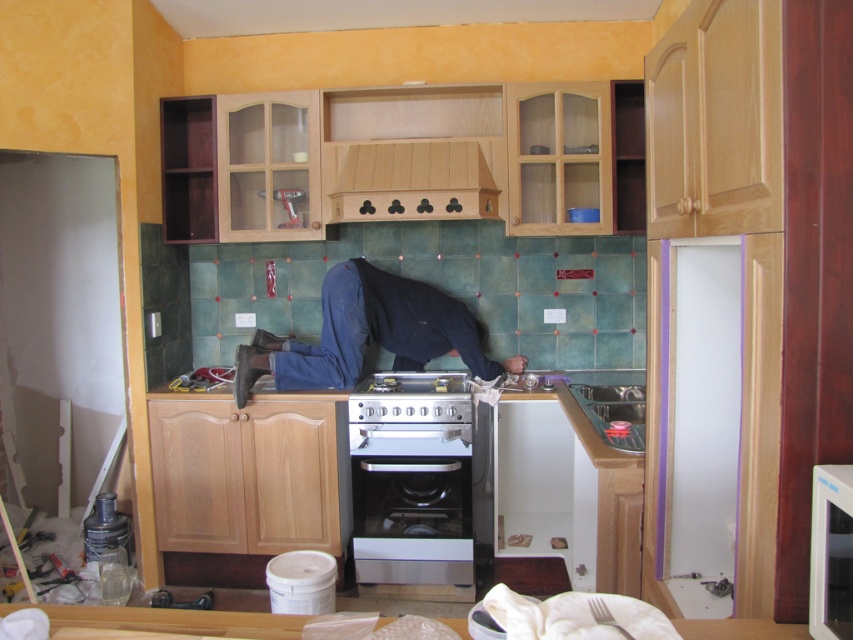
Who is more forward, (x=390, y=172) or (x=413, y=378)?

Point (x=390, y=172)

Is wooden exhaust hood at upper center shorter than silver metallic gas stove at center?

Incorrect, wooden exhaust hood at upper center's height does not fall short of silver metallic gas stove at center's.

Who is more distant from viewer, (340, 168) or (386, 404)?

Point (340, 168)

Find the location of a particular element. The height and width of the screenshot is (640, 853). wooden exhaust hood at upper center is located at coordinates (413, 182).

Who is shorter, blue denim jeans at center or matte stainless steel sink at lower right?

matte stainless steel sink at lower right is shorter.

Does point (352, 276) come closer to viewer compared to point (578, 392)?

That is False.

Does point (444, 340) come behind point (618, 406)?

Yes.

Locate an element on the screen. blue denim jeans at center is located at coordinates (369, 333).

Identify the location of white glossy microwave at upper right. This screenshot has height=640, width=853. (831, 552).

What do you see at coordinates (831, 552) in the screenshot? This screenshot has height=640, width=853. I see `white glossy microwave at upper right` at bounding box center [831, 552].

This screenshot has width=853, height=640. I want to click on white glossy microwave at upper right, so click(x=831, y=552).